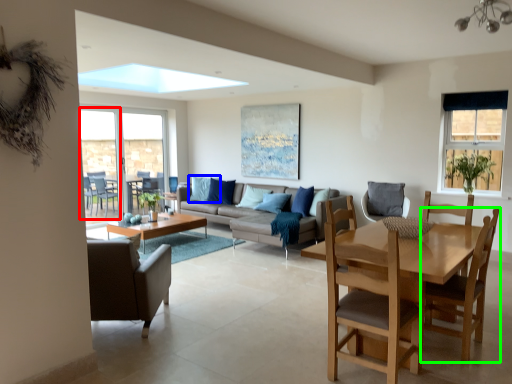
Question: Which is nearer to the screen door (highlighted by a red box)? pillow (highlighted by a blue box) or chair (highlighted by a green box).

Choices:
 (A) pillow
 (B) chair

Answer: (A)